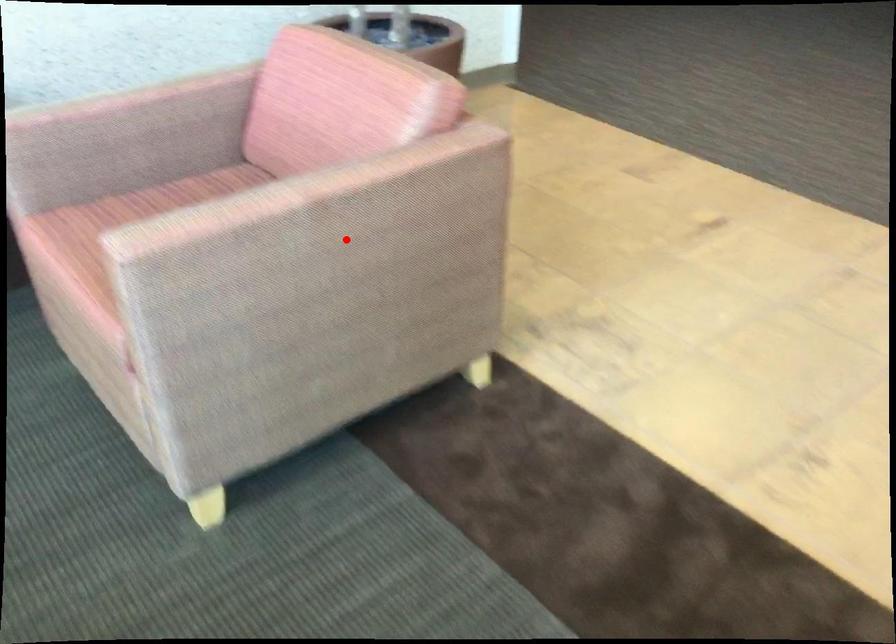
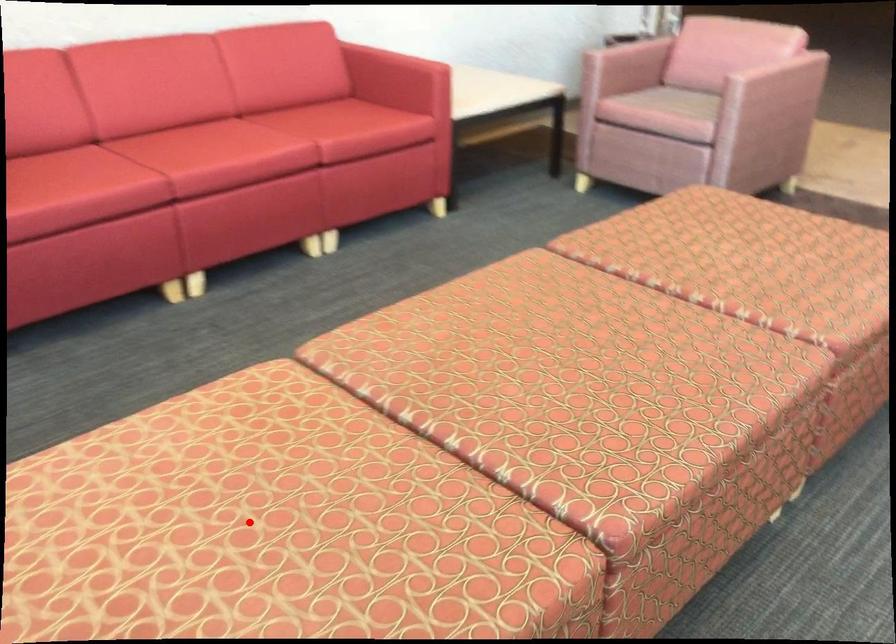
I am providing you with two images of the same scene from different viewpoints. A red point is marked on the first image and another point is marked on the second image. Does the point marked in image1 correspond to the same location as the one in image2?

No